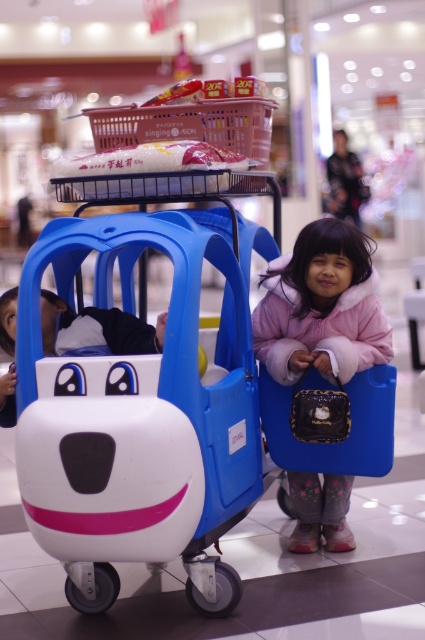
Does matte plastic baby carriage at center come behind pink fleece jacket at lower right?

That is False.

Which is in front, point (102, 472) or point (340, 340)?

Point (102, 472) is in front.

Locate an element on the screen. This screenshot has height=640, width=425. matte plastic baby carriage at center is located at coordinates (138, 417).